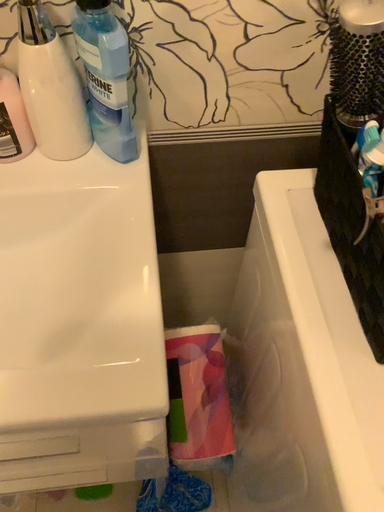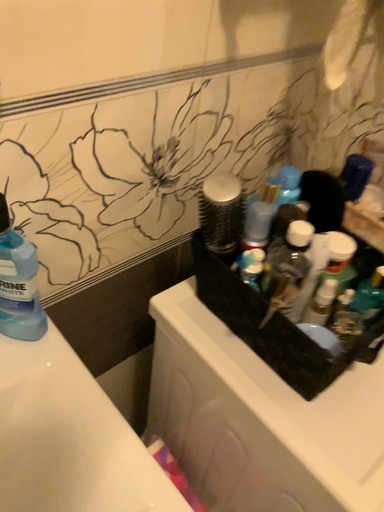
Question: How did the camera likely rotate when shooting the video?

Choices:
 (A) rotated downward
 (B) rotated upward

Answer: (B)